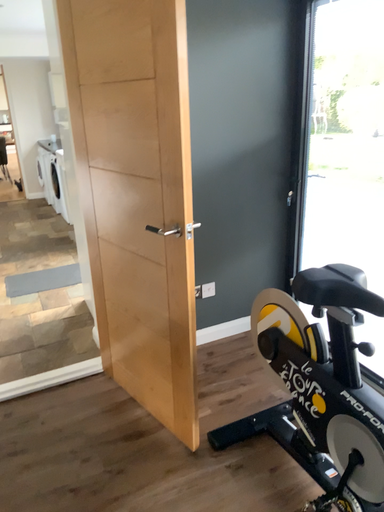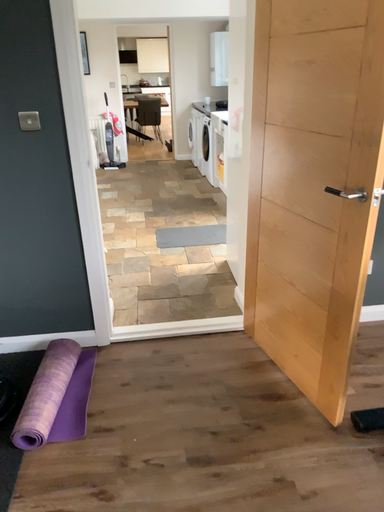
Question: Which way did the camera rotate in the video?

Choices:
 (A) rotated left
 (B) rotated right

Answer: (A)